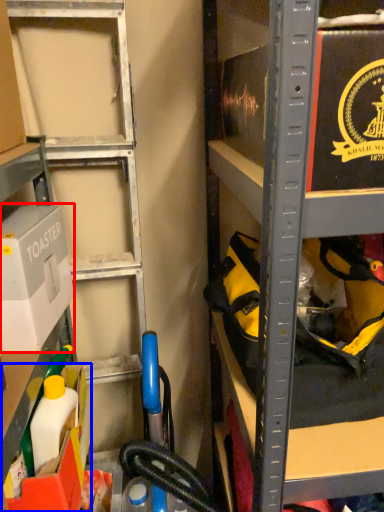
Question: Among these objects, which one is nearest to the camera, box (highlighted by a red box) or box (highlighted by a blue box)?

Choices:
 (A) box
 (B) box

Answer: (A)